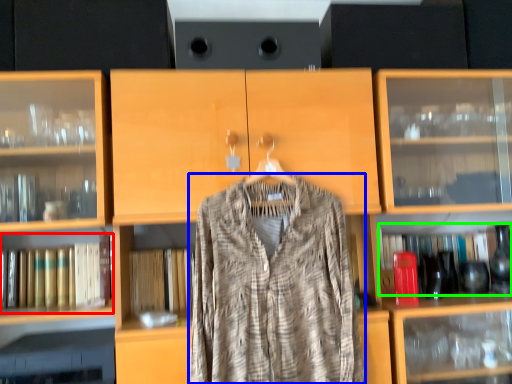
Question: Based on their relative distances, which object is nearer to book (highlighted by a red box)? Choose from fancy dress (highlighted by a blue box) and book (highlighted by a green box).

Choices:
 (A) fancy dress
 (B) book

Answer: (A)